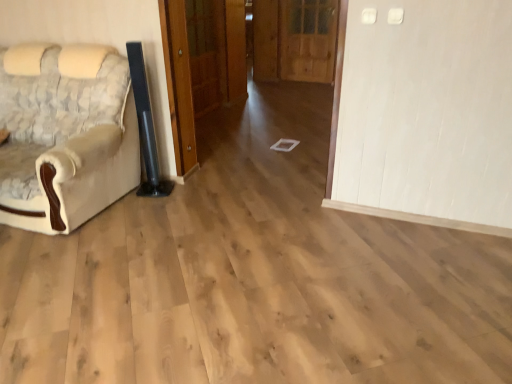
How much space does wooden door at center, which is counted as the second door, starting from the left, occupy horizontally?

17.74 centimeters.

Where is `wooden door at center, the second door from the right`? This screenshot has height=384, width=512. wooden door at center, the second door from the right is located at coordinates (179, 82).

Is beige fabric chair at left oriented towards wooden door at center, which is the 3th door from right to left?

No, beige fabric chair at left is not facing towards wooden door at center, which is the 3th door from right to left.

Consider the image. Is beige fabric chair at left thinner than wooden door at center, which is the 3th door from right to left?

In fact, beige fabric chair at left might be wider than wooden door at center, which is the 3th door from right to left.

Does beige fabric chair at left have a smaller size compared to wooden door at center, placed as the 1th door when sorted from left to right?

No, beige fabric chair at left is not smaller than wooden door at center, placed as the 1th door when sorted from left to right.

Which is correct: beige fabric chair at left is inside wooden door at center, placed as the 1th door when sorted from left to right, or outside of it?

beige fabric chair at left is located beyond the bounds of wooden door at center, placed as the 1th door when sorted from left to right.

Is wooden door at center, the second door from the right, outside of wooden door at center, which is the 3th door from right to left?

That's correct, wooden door at center, the second door from the right, is outside of wooden door at center, which is the 3th door from right to left.

Does point (243, 57) appear closer or farther from the camera than point (226, 94)?

Point (243, 57) is positioned farther from the camera compared to point (226, 94).

Based on their positions, is wooden door at center, the second door from the right, located to the left or right of wooden door at center, which is the 3th door from right to left?

In the image, wooden door at center, the second door from the right, appears on the right side of wooden door at center, which is the 3th door from right to left.

Who is taller, wooden door at center, placed as the 1th door when sorted from left to right, or beige fabric chair at left?

Standing taller between the two is wooden door at center, placed as the 1th door when sorted from left to right.

Which door is the 1st one when counting from the right side of the beige fabric chair at left? Please provide its 2D coordinates.

[(207, 54)]

How much distance is there between wooden door at center, placed as the 1th door when sorted from left to right, and beige fabric chair at left?

wooden door at center, placed as the 1th door when sorted from left to right, is 6.73 feet away from beige fabric chair at left.

From the image's perspective, is wooden door at center, which is the 3th door from right to left, located above beige fabric chair at left?

Indeed, from the image's perspective, wooden door at center, which is the 3th door from right to left, is shown above beige fabric chair at left.

Which of these two, beige fabric chair at left or wooden door at center, which is the third door in left-to-right order, is smaller?

wooden door at center, which is the third door in left-to-right order, is smaller.

Is beige fabric chair at left wider or thinner than wooden door at center, which is the third door in left-to-right order?

Considering their sizes, beige fabric chair at left looks broader than wooden door at center, which is the third door in left-to-right order.

Which point is more distant from viewer, (52,131) or (303,75)?

The point (303,75) is behind.

From a real-world perspective, is beige fabric chair at left beneath wooden door at center, which is the third door in left-to-right order?

Yes, from a real-world perspective, beige fabric chair at left is under wooden door at center, which is the third door in left-to-right order.

How different are the orientations of wooden door at center, the second door from the right, and wooden door at center, the first door in the right-to-left sequence, in degrees?

They differ by 90.5 degrees in their facing directions.

The height and width of the screenshot is (384, 512). In order to click on door below the wooden door at center, which is counted as the second door, starting from the left (from a real-world perspective) in this screenshot , I will do `click(308, 40)`.

Is wooden door at center, which is the third door in left-to-right order, at the back of wooden door at center, which is counted as the second door, starting from the left?

wooden door at center, which is counted as the second door, starting from the left, does not have its back to wooden door at center, which is the third door in left-to-right order.

Measure the distance between wooden door at center, which is the 3th door from right to left, and wooden door at center, the second door from the right.

wooden door at center, which is the 3th door from right to left, and wooden door at center, the second door from the right, are 10.17 inches apart from each other.

Consider the image. Is wooden door at center, placed as the 1th door when sorted from left to right, positioned far away from wooden door at center, the second door from the right?

No, wooden door at center, placed as the 1th door when sorted from left to right, is not far away from wooden door at center, the second door from the right.

Which object is more forward, wooden door at center, which is the 3th door from right to left, or wooden door at center, the second door from the right?

wooden door at center, the second door from the right.

Which of these two, wooden door at center, which is the 3th door from right to left, or wooden door at center, which is counted as the second door, starting from the left, stands taller?

With more height is wooden door at center, which is counted as the second door, starting from the left.

Is wooden door at center, the first door in the right-to-left sequence, not close to wooden door at center, the second door from the right?

Indeed, wooden door at center, the first door in the right-to-left sequence, is not near wooden door at center, the second door from the right.

Is wooden door at center, the first door in the right-to-left sequence, in front of or behind wooden door at center, the second door from the right, in the image?

wooden door at center, the first door in the right-to-left sequence, is behind wooden door at center, the second door from the right.

Is wooden door at center, which is the third door in left-to-right order, positioned beyond the bounds of wooden door at center, the second door from the right?

Yes.

You are a GUI agent. You are given a task and a screenshot of the screen. Output one action in this format:
    pyautogui.click(x=<x>, y=<y>)
    Task: Click on the chair to the left of wooden door at center, which is the 3th door from right to left
    
    Given the screenshot: What is the action you would take?
    pyautogui.click(x=65, y=134)

Find the location of a particular element. door in front of the wooden door at center, placed as the 1th door when sorted from left to right is located at coordinates (179, 82).

Considering their positions, is wooden door at center, the first door in the right-to-left sequence, positioned closer to wooden door at center, which is the 3th door from right to left, than beige fabric chair at left?

wooden door at center, the first door in the right-to-left sequence.

Considering their positions, is wooden door at center, the second door from the right, positioned closer to wooden door at center, which is the 3th door from right to left, than wooden door at center, which is the third door in left-to-right order?

wooden door at center, the second door from the right.

Based on their spatial positions, is wooden door at center, which is the 3th door from right to left, or beige fabric chair at left closer to wooden door at center, which is counted as the second door, starting from the left?

wooden door at center, which is the 3th door from right to left.

Looking at the image, which one is located further to wooden door at center, the first door in the right-to-left sequence, wooden door at center, the second door from the right, or wooden door at center, which is the 3th door from right to left?

wooden door at center, which is the 3th door from right to left, lies further to wooden door at center, the first door in the right-to-left sequence, than the other object.

Estimate the real-world distances between objects in this image. Which object is further from beige fabric chair at left, wooden door at center, which is counted as the second door, starting from the left, or wooden door at center, which is the 3th door from right to left?

wooden door at center, which is counted as the second door, starting from the left, lies further to beige fabric chair at left than the other object.

Estimate the real-world distances between objects in this image. Which object is closer to beige fabric chair at left, wooden door at center, the second door from the right, or wooden door at center, which is the third door in left-to-right order?

wooden door at center, the second door from the right, lies closer to beige fabric chair at left than the other object.

Which object lies nearer to the anchor point wooden door at center, the second door from the right, beige fabric chair at left or wooden door at center, the first door in the right-to-left sequence?

Among the two, wooden door at center, the first door in the right-to-left sequence, is located nearer to wooden door at center, the second door from the right.

In the scene shown: Considering their positions, is wooden door at center, which is the third door in left-to-right order, positioned closer to beige fabric chair at left than wooden door at center, placed as the 1th door when sorted from left to right?

Among the two, wooden door at center, placed as the 1th door when sorted from left to right, is located nearer to beige fabric chair at left.

The height and width of the screenshot is (384, 512). Find the location of `door between wooden door at center, which is counted as the second door, starting from the left, and wooden door at center, the first door in the right-to-left sequence, along the z-axis`. door between wooden door at center, which is counted as the second door, starting from the left, and wooden door at center, the first door in the right-to-left sequence, along the z-axis is located at coordinates coord(207,54).

Where is `door between beige fabric chair at left and wooden door at center, placed as the 1th door when sorted from left to right, along the z-axis`? The image size is (512, 384). door between beige fabric chair at left and wooden door at center, placed as the 1th door when sorted from left to right, along the z-axis is located at coordinates (179, 82).